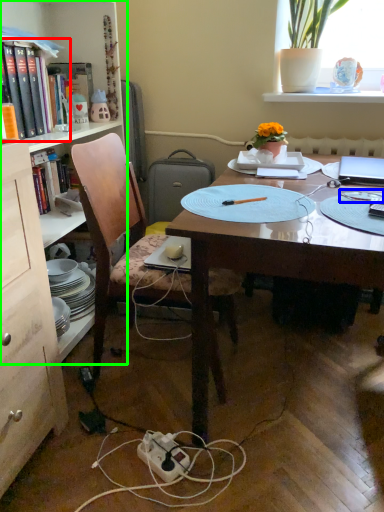
Question: Which object is the closest to the book (highlighted by a red box)? Choose among these: tableware (highlighted by a blue box) or bookcase (highlighted by a green box).

Choices:
 (A) tableware
 (B) bookcase

Answer: (B)